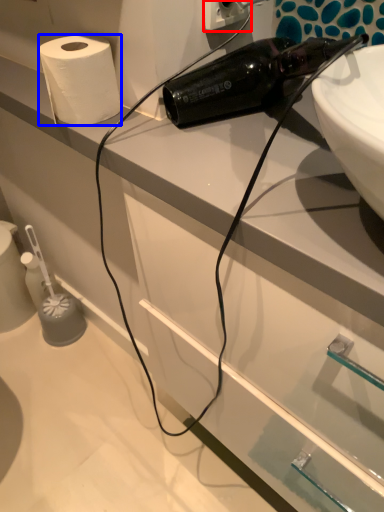
Question: Which point is further to the camera, electric outlet (highlighted by a red box) or paper towel (highlighted by a blue box)?

Choices:
 (A) electric outlet
 (B) paper towel

Answer: (B)